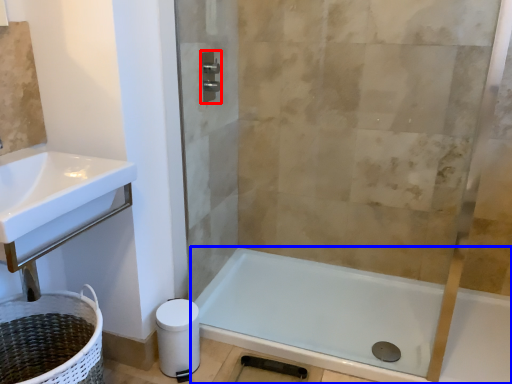
Question: Which of the following is the closest to the observer, towel bar (highlighted by a red box) or bathtub (highlighted by a blue box)?

Choices:
 (A) towel bar
 (B) bathtub

Answer: (B)